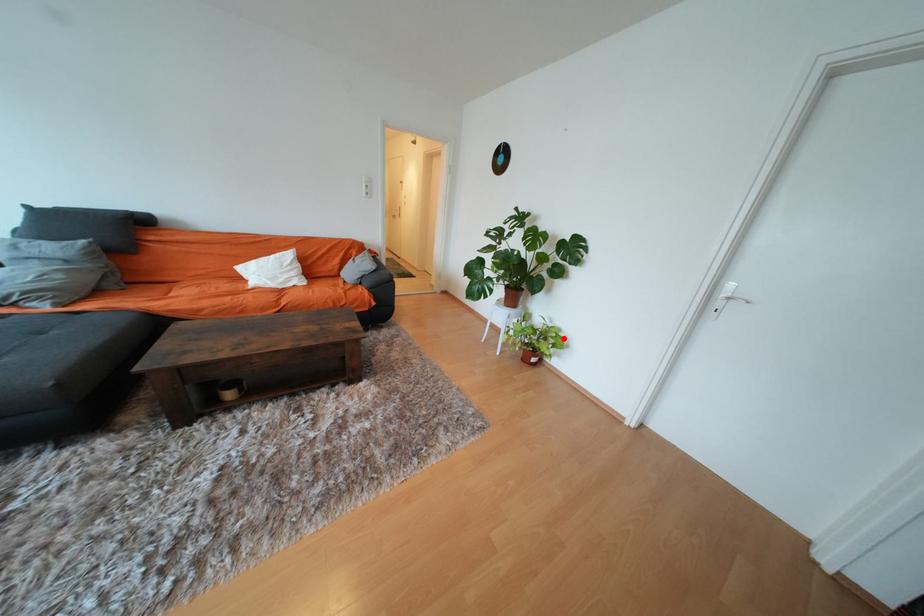
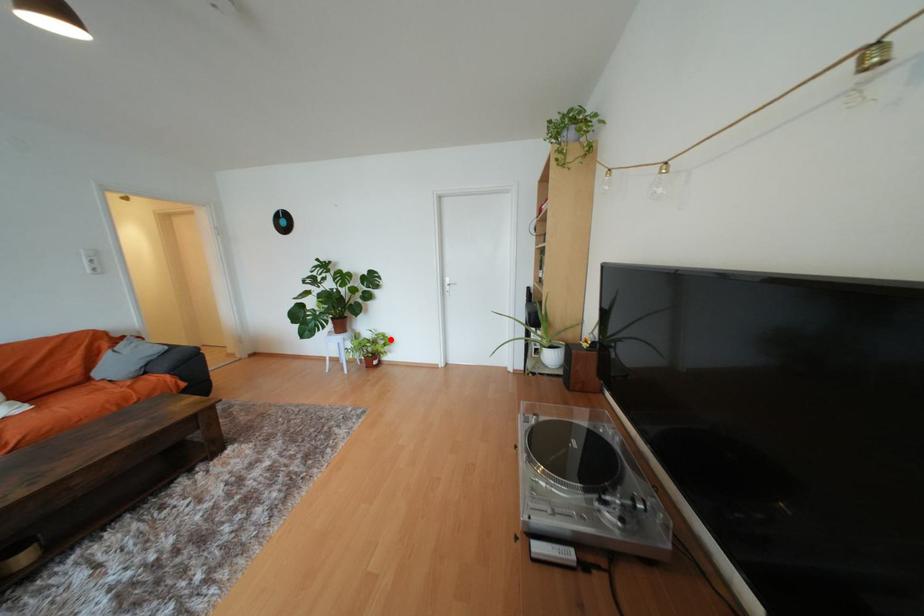
I am providing you with two images of the same scene from different viewpoints. A red point is marked on the first image and another point is marked on the second image. Is the red point in image1 aligned with the point shown in image2?

Yes